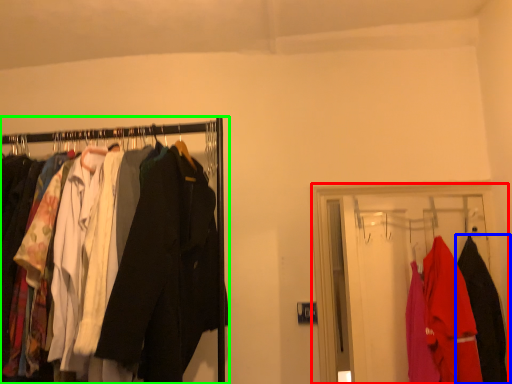
Question: Estimate the real-world distances between objects in this image. Which object is closer to closet (highlighted by a red box), fancy dress (highlighted by a blue box) or closet (highlighted by a green box)?

Choices:
 (A) fancy dress
 (B) closet

Answer: (A)